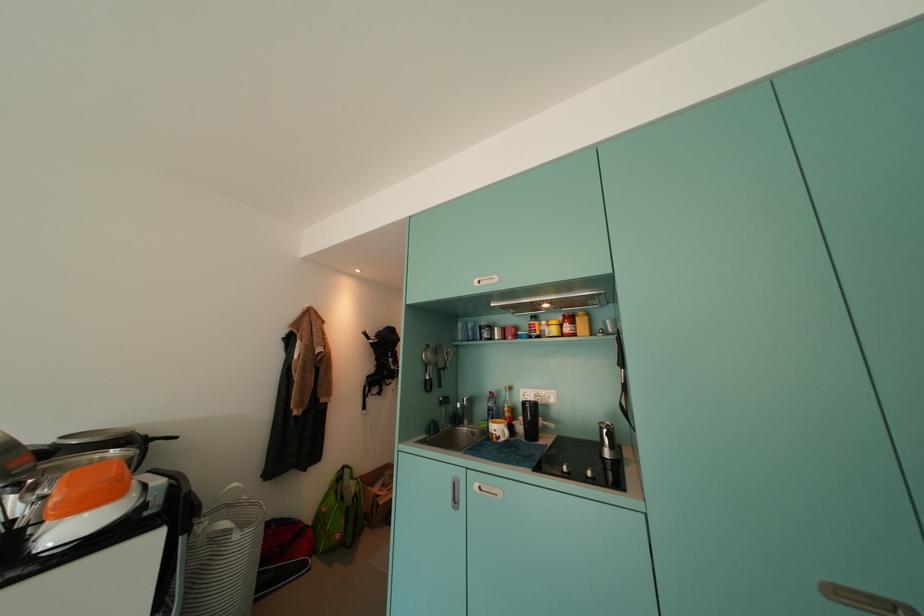
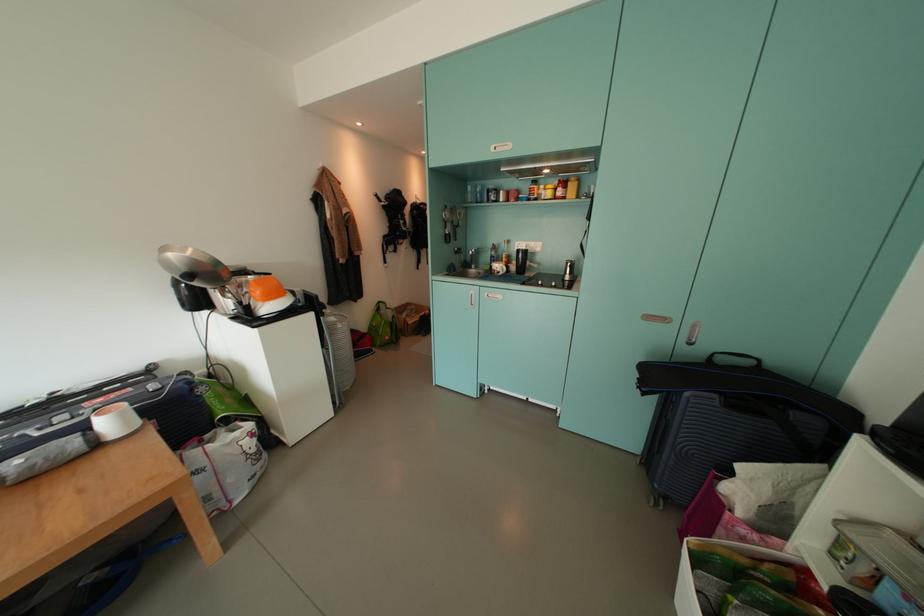
Which direction would the cameraman need to move to produce the second image?

The movement direction of the cameraman is left, backward.